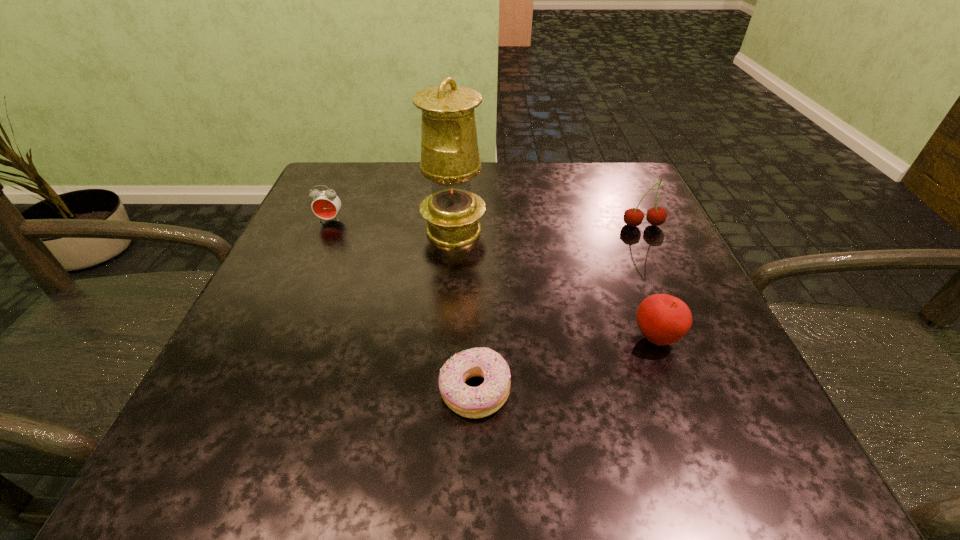
Where is `blank space located on the back of the doughnut`? This screenshot has width=960, height=540. blank space located on the back of the doughnut is located at coordinates (476, 286).

Identify the location of oil lamp at the far edge. The width and height of the screenshot is (960, 540). (450, 158).

The height and width of the screenshot is (540, 960). What are the coordinates of `alarm clock that is positioned at the far edge` in the screenshot? It's located at (326, 204).

At what (x,y) coordinates should I click in order to perform the action: click on object positioned at the near edge. Please return your answer as a coordinate pair (x, y). Image resolution: width=960 pixels, height=540 pixels. Looking at the image, I should click on pos(471,402).

Where is `object present at the left edge`? Image resolution: width=960 pixels, height=540 pixels. object present at the left edge is located at coordinates (326, 204).

Where is `cherry positioned at the right edge`? Image resolution: width=960 pixels, height=540 pixels. cherry positioned at the right edge is located at coordinates (633, 217).

At what (x,y) coordinates should I click in order to perform the action: click on apple at the right edge. Please return your answer as a coordinate pair (x, y). Looking at the image, I should click on (663, 319).

Locate an element on the screen. object that is at the far left corner is located at coordinates point(326,204).

The width and height of the screenshot is (960, 540). Identify the location of vacant space at the far edge of the desktop. (388, 183).

What are the coordinates of `vacant space at the near edge` in the screenshot? It's located at (635, 472).